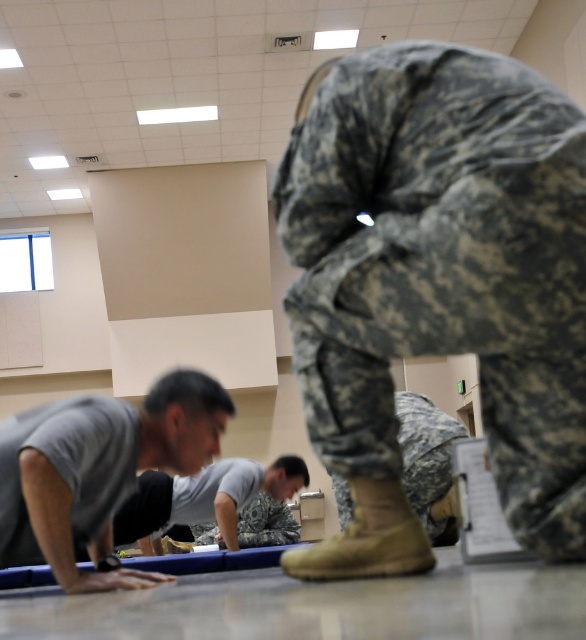
You are a photographer trying to capture a group photo of the camouflage fabric uniform at upper center and the camouflage fabric pants at center. Since you want to ensure both subjects are in focus, you need to know which one is wider. Which one has a greater width?

The camouflage fabric uniform at upper center has a greater width than the camouflage fabric pants at center.

You are standing in the gym and see two points marked on the floor at coordinates point (x=546, y=333) and point (x=438, y=468). If you want to walk towards the point that is closer to the camera, which coordinate should you head towards?

Point (x=546, y=333) is in front of point (x=438, y=468), so you should head towards point (x=546, y=333) as it is closer to the camera.

You are a photographer positioned at the entrance of the gym. You need to capture a photo that includes both the gray matte shirt at lower left and the camouflage fabric uniform at center. Which object should be placed closer to the left side of the photo frame?

The gray matte shirt at lower left should be placed closer to the left side of the photo frame because it is positioned on the left side of the camouflage fabric uniform at center.